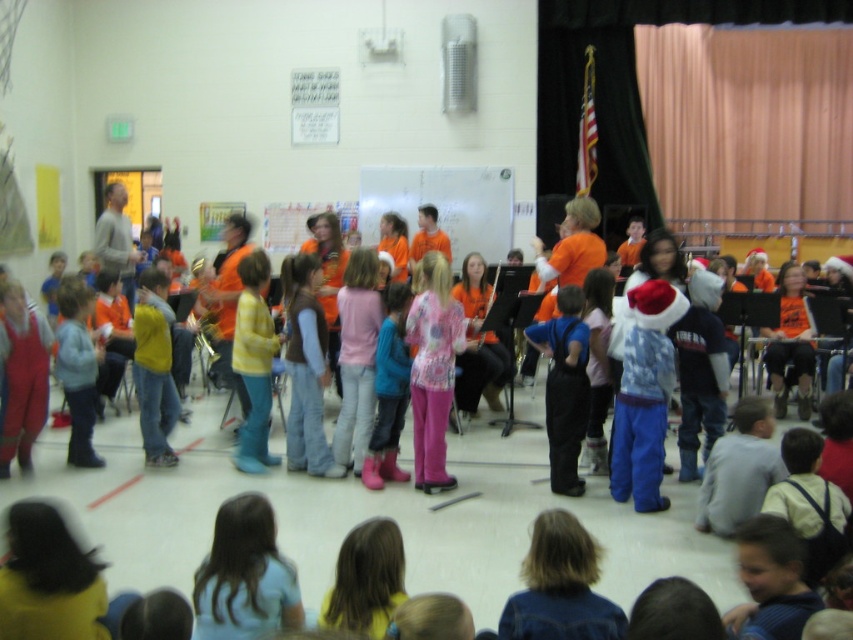
Question: Which of the following is the closest to the observer?

Choices:
 (A) (392, 424)
 (B) (552, 330)

Answer: (B)

Question: Which of the following is the closest to the observer?

Choices:
 (A) pos(575,326)
 (B) pos(404,371)

Answer: (A)

Question: Where is blue denim overalls at center located in relation to pink rubber boots at center in the image?

Choices:
 (A) left
 (B) right

Answer: (B)

Question: Is blue denim overalls at center smaller than pink rubber boots at center?

Choices:
 (A) yes
 (B) no

Answer: (B)

Question: Does blue denim overalls at center have a smaller size compared to pink rubber boots at center?

Choices:
 (A) yes
 (B) no

Answer: (B)